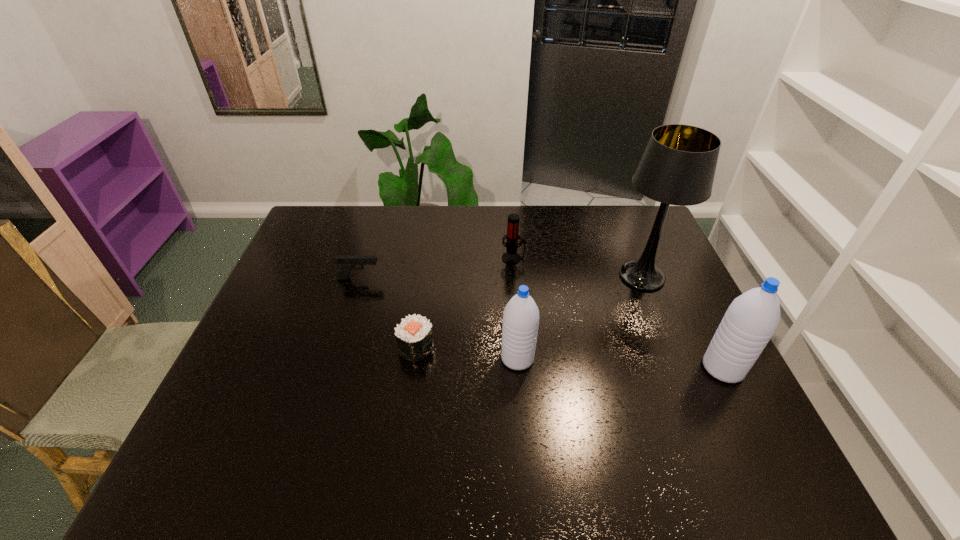
Image resolution: width=960 pixels, height=540 pixels. What are the coordinates of `the third tallest object` in the screenshot? It's located at (520, 325).

Locate an element on the screen. The image size is (960, 540). the left water bottle is located at coordinates (520, 325).

You are a GUI agent. You are given a task and a screenshot of the screen. Output one action in this format:
    pyautogui.click(x=<x>, y=<y>)
    Task: Click on the right water bottle
    
    Given the screenshot: What is the action you would take?
    [750, 321]

Identify the location of the taller water bottle. (750, 321).

At what (x,y) coordinates should I click in order to perform the action: click on microphone. Please return your answer as a coordinate pair (x, y). The height and width of the screenshot is (540, 960). Looking at the image, I should click on (510, 257).

In order to click on the leftmost object in this screenshot , I will do [x=347, y=262].

This screenshot has width=960, height=540. What are the coordinates of `table lamp` in the screenshot? It's located at (678, 166).

Where is `sushi`? The width and height of the screenshot is (960, 540). sushi is located at coordinates (414, 335).

Find the location of `vacant point located 0.250m on the left of the shorter water bottle`. vacant point located 0.250m on the left of the shorter water bottle is located at coordinates (405, 359).

Find the location of a particular element. The width and height of the screenshot is (960, 540). free space located 0.100m on the back of the taller water bottle is located at coordinates (701, 323).